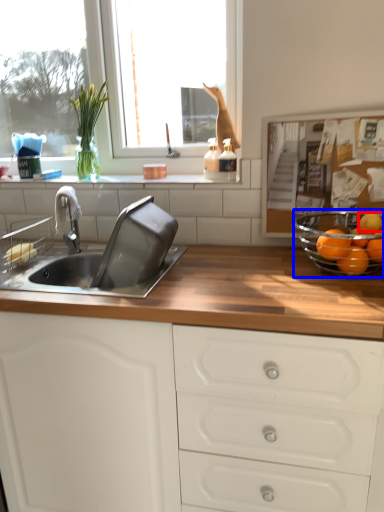
Question: Which point is closer to the camera, orange (highlighted by a red box) or glass bowl (highlighted by a blue box)?

Choices:
 (A) orange
 (B) glass bowl

Answer: (B)